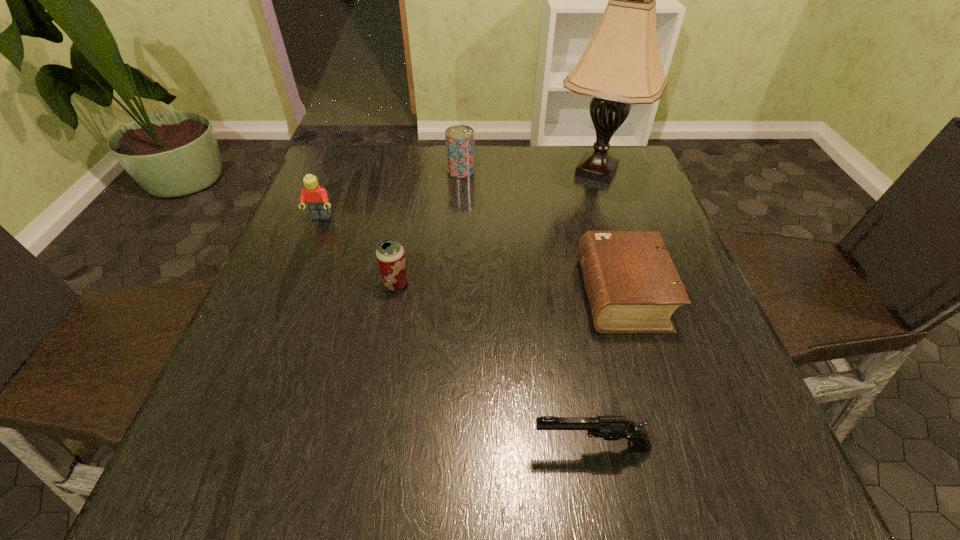
The width and height of the screenshot is (960, 540). I want to click on vacant space located 0.190m on the left of the farther beer can, so click(x=378, y=171).

Where is `free space located 0.260m on the face of the leftmost object`? The image size is (960, 540). free space located 0.260m on the face of the leftmost object is located at coordinates (286, 306).

Identify the location of vacant space located 0.180m on the right of the nearer beer can. (x=495, y=284).

You are a GUI agent. You are given a task and a screenshot of the screen. Output one action in this format:
    pyautogui.click(x=<x>, y=<y>)
    Task: Click on the free region located at the end of the barrel of the gun
    
    Given the screenshot: What is the action you would take?
    pyautogui.click(x=280, y=447)

Where is `blank space located at the end of the barrel of the gun`? blank space located at the end of the barrel of the gun is located at coordinates (500, 447).

Where is `vacant space located at the end of the barrel of the gun`? Image resolution: width=960 pixels, height=540 pixels. vacant space located at the end of the barrel of the gun is located at coordinates click(474, 447).

Identify the location of free space located on the spine side of the Bible. point(386,294).

Locate an element on the screen. This screenshot has width=960, height=540. vacant region located 0.340m on the spine side of the Bible is located at coordinates (416, 294).

You are a GUI agent. You are given a task and a screenshot of the screen. Output one action in this format:
    pyautogui.click(x=<x>, y=<y>)
    Task: Click on the vacant space located 0.290m on the spine side of the Bible
    Image resolution: width=960 pixels, height=540 pixels.
    Given the screenshot: What is the action you would take?
    pyautogui.click(x=440, y=294)

Where is `lamp that is at the far edge`? This screenshot has width=960, height=540. lamp that is at the far edge is located at coordinates (621, 65).